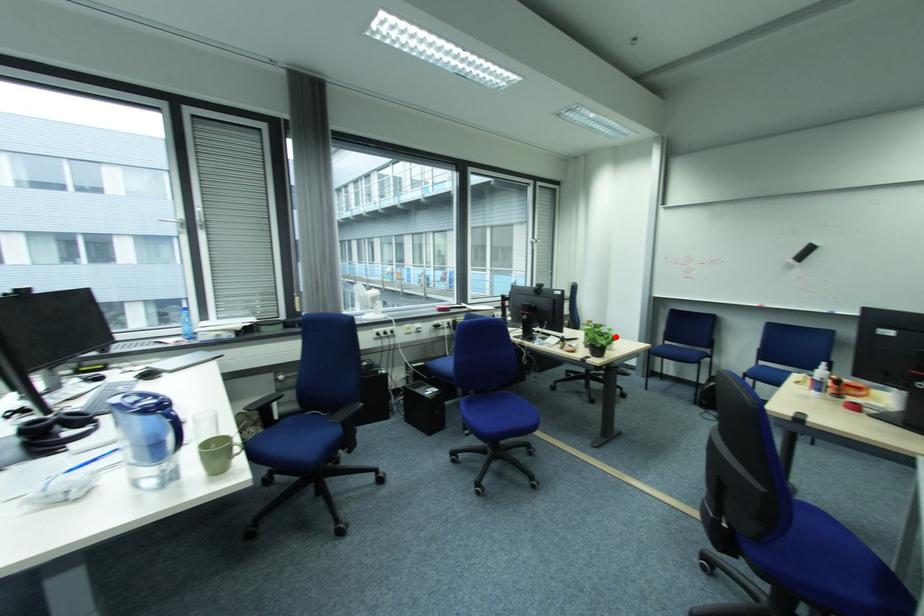
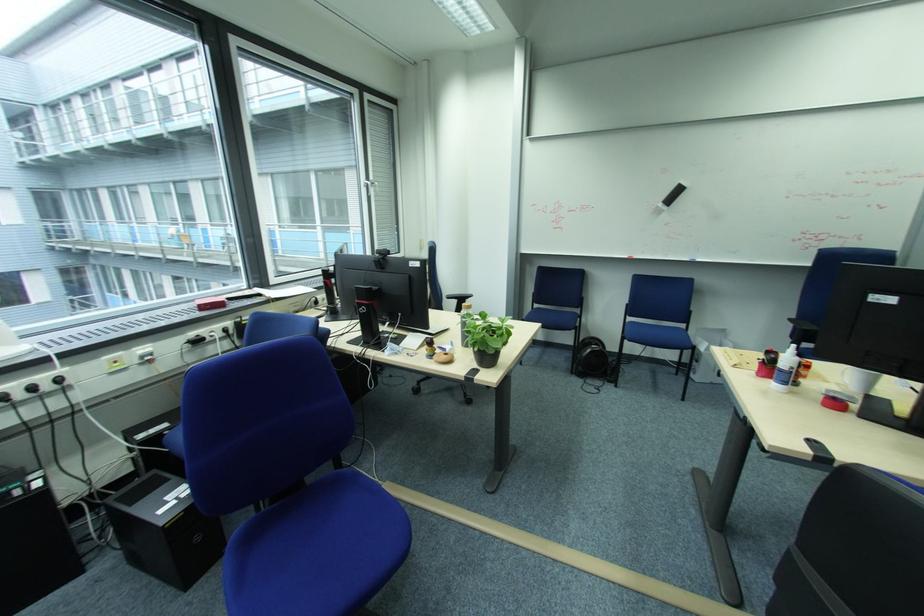
In the second image, find the point that corresponds to the highlighted location in the first image.

(508, 333)